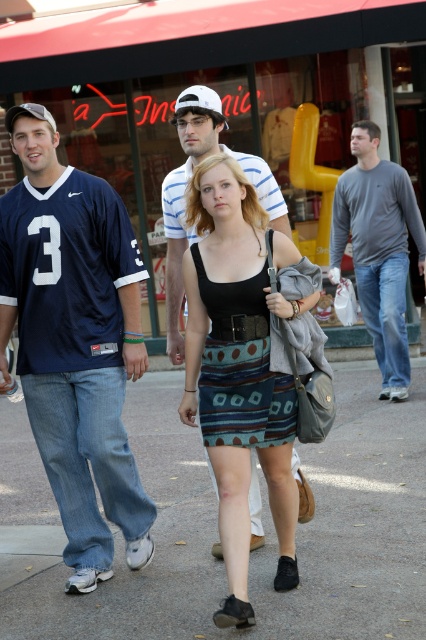
Is matte black tank top at center behind striped cotton shirt at center?

No, matte black tank top at center is closer to the viewer.

Which is more to the right, matte black tank top at center or striped cotton shirt at center?

matte black tank top at center

The image size is (426, 640). Find the location of `matte black tank top at center`. matte black tank top at center is located at coordinates (238, 358).

From the picture: Measure the distance between navy blue jersey at center and striped cotton shirt at center.

The distance of navy blue jersey at center from striped cotton shirt at center is 78.21 centimeters.

Does navy blue jersey at center have a smaller size compared to striped cotton shirt at center?

Yes, navy blue jersey at center is smaller than striped cotton shirt at center.

Which is behind, point (83, 419) or point (258, 170)?

The point (258, 170) is more distant.

The width and height of the screenshot is (426, 640). Identify the location of navy blue jersey at center. (74, 342).

Can you confirm if matte black tank top at center is thinner than black fabric sandal at lower center?

In fact, matte black tank top at center might be wider than black fabric sandal at lower center.

Which is behind, point (241, 298) or point (235, 609)?

The point (241, 298) is behind.

You are a GUI agent. You are given a task and a screenshot of the screen. Output one action in this format:
    pyautogui.click(x=<x>, y=<y>)
    Task: Click on the matte black tank top at center
    The image size is (426, 640).
    Given the screenshot: What is the action you would take?
    pyautogui.click(x=238, y=358)